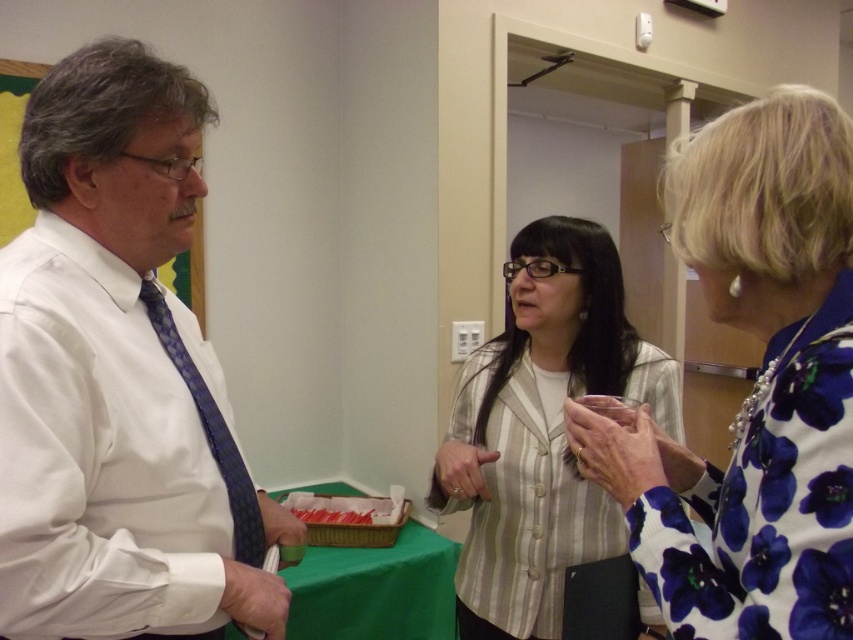
Who is shorter, floral-patterned blouse at right or blue patterned tie at left?

With less height is blue patterned tie at left.

Which is in front, point (619, 456) or point (238, 554)?

Point (619, 456) is more forward.

This screenshot has height=640, width=853. Identify the location of floral-patterned blouse at right. (753, 385).

Is striped fabric blazer at center thinner than blue patterned tie at left?

No, striped fabric blazer at center is not thinner than blue patterned tie at left.

Can you confirm if striped fabric blazer at center is positioned below blue patterned tie at left?

Indeed, striped fabric blazer at center is positioned under blue patterned tie at left.

This screenshot has height=640, width=853. Identify the location of striped fabric blazer at center. (541, 429).

Who is positioned more to the left, floral-patterned blouse at right or green fabric table at center?

Positioned to the left is green fabric table at center.

Based on the photo, can you confirm if floral-patterned blouse at right is positioned below green fabric table at center?

Actually, floral-patterned blouse at right is above green fabric table at center.

Which is behind, point (785, 376) or point (422, 534)?

Point (422, 534)

The image size is (853, 640). Identify the location of floral-patterned blouse at right. [753, 385].